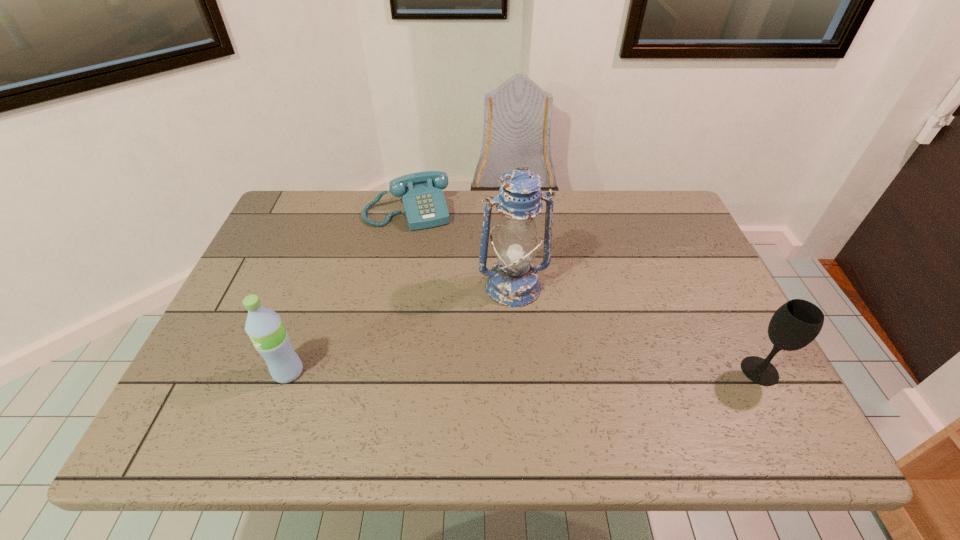
Find the location of `free space located 0.390m on the dial of the shortest object`. free space located 0.390m on the dial of the shortest object is located at coordinates (448, 330).

At what (x,y) coordinates should I click in order to perform the action: click on vacant space located on the dial of the shortest object. Please return your answer as a coordinate pair (x, y). Image resolution: width=960 pixels, height=540 pixels. Looking at the image, I should click on coord(424,254).

I want to click on vacant region located on the dial of the shortest object, so click(x=420, y=244).

Find the location of a particular element. The image size is (960, 540). vacant area located on the front-facing side of the tallest object is located at coordinates (539, 376).

This screenshot has width=960, height=540. I want to click on free space located 0.090m on the front-facing side of the tallest object, so click(528, 336).

You are a GUI agent. You are given a task and a screenshot of the screen. Output one action in this format:
    pyautogui.click(x=<x>, y=<y>)
    Task: Click on the vacant space located on the front-facing side of the tallest object
    The height and width of the screenshot is (540, 960).
    Given the screenshot: What is the action you would take?
    pyautogui.click(x=524, y=323)

Find the location of a particular element. object that is at the far edge is located at coordinates (422, 196).

You are a GUI agent. You are given a task and a screenshot of the screen. Output one action in this format:
    pyautogui.click(x=<x>, y=<y>)
    Task: Click on the water bottle that is positioned at the near edge
    This screenshot has width=960, height=540.
    Given the screenshot: What is the action you would take?
    pyautogui.click(x=270, y=338)

The width and height of the screenshot is (960, 540). Identify the location of wineglass that is at the near edge. (795, 324).

The height and width of the screenshot is (540, 960). I want to click on object present at the right edge, so click(795, 324).